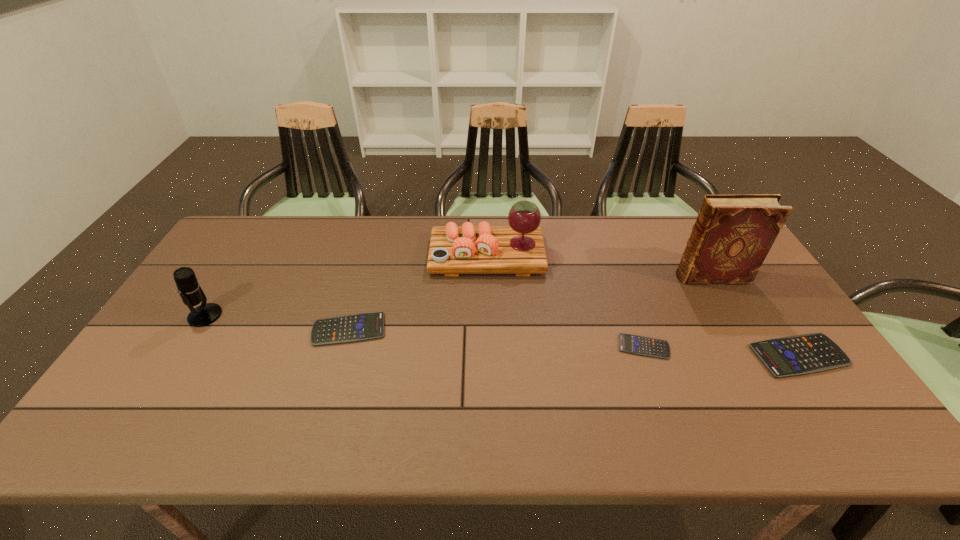
You are a GUI agent. You are given a task and a screenshot of the screen. Output one action in this format:
    pyautogui.click(x=<x>, y=<y>)
    Task: Click on the hardback book located in the right edge section of the desktop
    
    Given the screenshot: What is the action you would take?
    pyautogui.click(x=733, y=233)

Locate an element on the screen. Image resolution: width=960 pixels, height=540 pixels. object located at the near right corner is located at coordinates [x=803, y=354].

Locate an element on the screen. The width and height of the screenshot is (960, 540). free spot at the far edge of the desktop is located at coordinates (388, 227).

Locate an element on the screen. The width and height of the screenshot is (960, 540). free space at the near edge of the desktop is located at coordinates (468, 399).

The image size is (960, 540). What are the coordinates of `vacant space at the left edge` in the screenshot? It's located at (165, 353).

The height and width of the screenshot is (540, 960). I want to click on free spot at the far left corner of the desktop, so click(x=225, y=245).

Locate an element on the screen. free space at the near right corner is located at coordinates (784, 394).

Identify the location of free space that is in between the fourth object from right to left and the leftmost object. (346, 286).

Where is `free space between the fourth object from right to left and the rightmost calculator`? The image size is (960, 540). free space between the fourth object from right to left and the rightmost calculator is located at coordinates (643, 306).

At what (x,y) coordinates should I click in order to perform the action: click on vacant area that lies between the rightmost calculator and the hardback book. Please return your answer as a coordinate pair (x, y). This screenshot has height=540, width=960. Looking at the image, I should click on (756, 316).